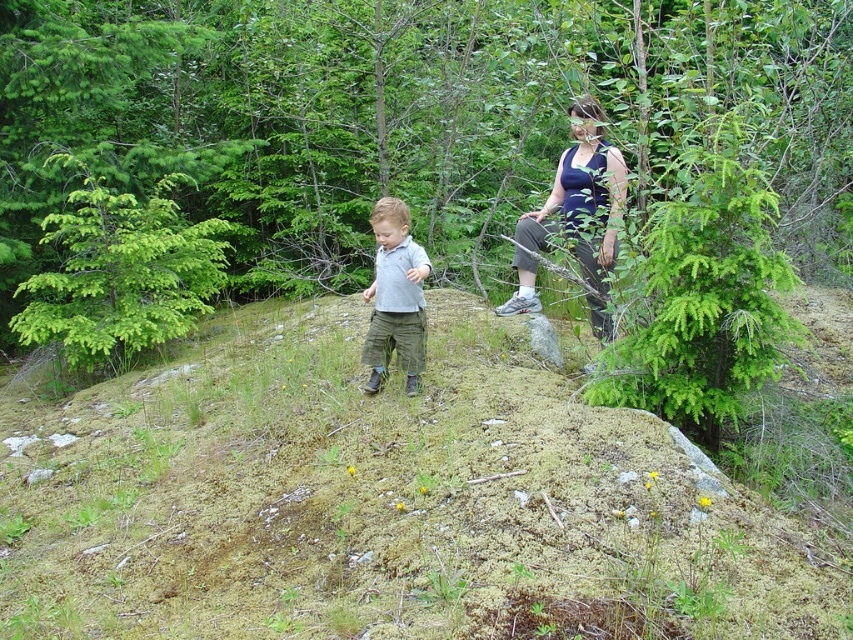
Who is higher up, dark blue tank top at upper right or light gray cotton shirt at center?

dark blue tank top at upper right

Is dark blue tank top at upper right positioned before light gray cotton shirt at center?

Yes, dark blue tank top at upper right is closer to the viewer.

Which is in front, point (569, 108) or point (393, 260)?

Point (393, 260)

Locate an element on the screen. Image resolution: width=853 pixels, height=640 pixels. dark blue tank top at upper right is located at coordinates (576, 216).

Between green mossy hillside at center and green leafy tree at center, which one has more height?

green mossy hillside at center is taller.

Is green mossy hillside at center closer to camera compared to green leafy tree at center?

That is True.

I want to click on green mossy hillside at center, so click(x=381, y=499).

Does green leafy tree at center have a lesser width compared to dark blue tank top at upper right?

Correct, green leafy tree at center's width is less than dark blue tank top at upper right's.

Based on the photo, is the position of green leafy tree at center more distant than that of dark blue tank top at upper right?

No, green leafy tree at center is in front of dark blue tank top at upper right.

Where is `green leafy tree at center`? This screenshot has width=853, height=640. green leafy tree at center is located at coordinates (402, 118).

Locate an element on the screen. green leafy tree at center is located at coordinates (402, 118).